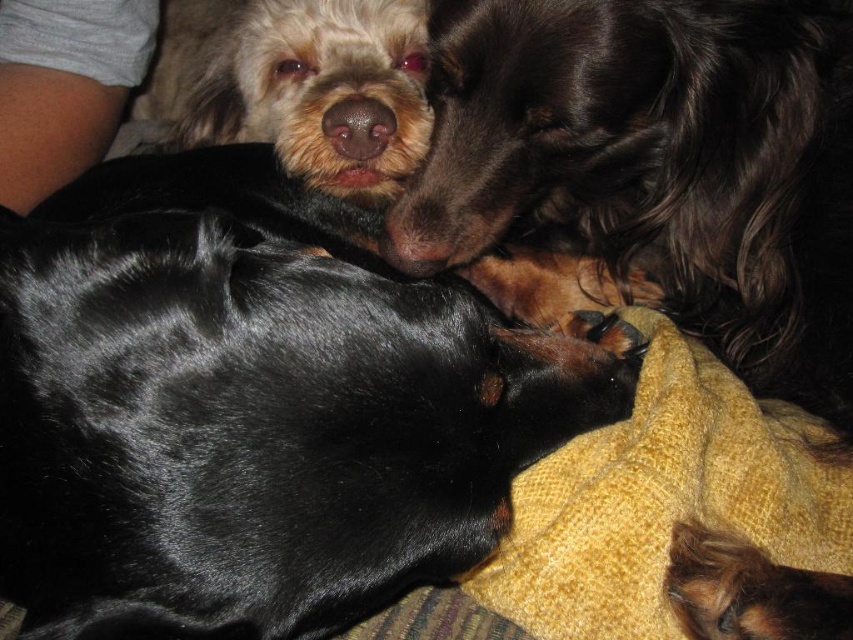
Question: Considering the real-world distances, which object is farthest from the shiny brown fur at lower right?

Choices:
 (A) shiny black coat at upper center
 (B) shaggy white fur at upper left

Answer: (B)

Question: Is yellow textured blanket at lower right to the left of shiny black coat at upper center from the viewer's perspective?

Choices:
 (A) yes
 (B) no

Answer: (B)

Question: Does black shiny dog at upper center appear under shiny black coat at upper center?

Choices:
 (A) no
 (B) yes

Answer: (B)

Question: Which point is farther to the camera?

Choices:
 (A) (787, 538)
 (B) (813, 604)

Answer: (A)

Question: Can you confirm if black shiny dog at upper center is positioned above brown matte nose at center?

Choices:
 (A) no
 (B) yes

Answer: (A)

Question: Which point appears farthest from the camera in this image?

Choices:
 (A) (747, 554)
 (B) (274, 35)
 (C) (480, 573)
 (D) (250, 67)

Answer: (D)